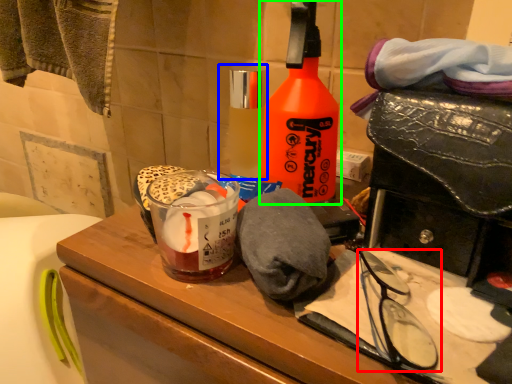
Question: Based on their relative distances, which object is farther from glasses (highlighted by a red box)? Choose from bottle (highlighted by a blue box) and bottle (highlighted by a green box).

Choices:
 (A) bottle
 (B) bottle

Answer: (A)